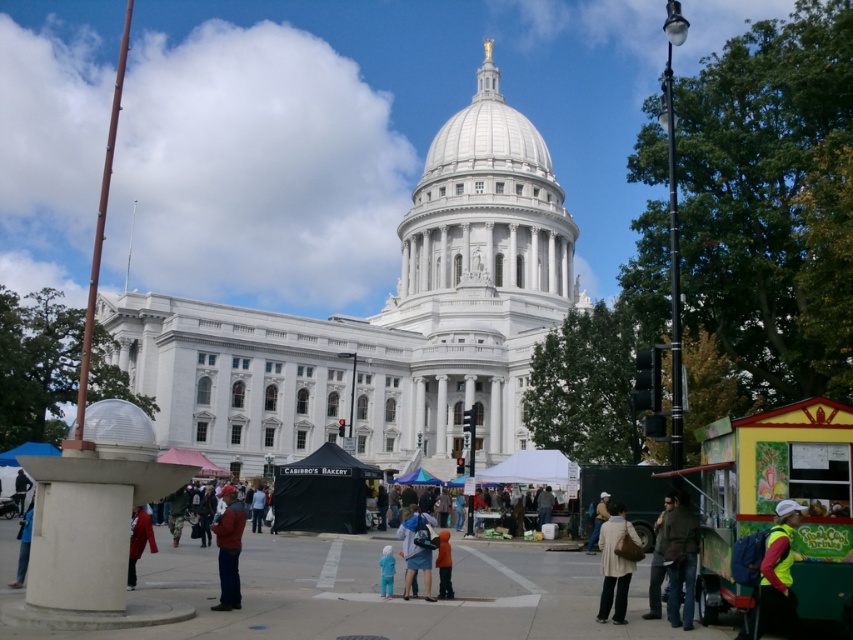
You are standing at the grand white building with a dome and want to take a photo of the point at coordinates (x=653, y=593). If your camera has a maximum focus range of 120 feet, will you be able to capture the point clearly?

The distance of point (x=653, y=593) from the camera is 128.06 feet, which exceeds the camera maximum focus range of 120 feet. Therefore, you won not be able to capture the point clearly.

Consider the image. You are a photographer trying to capture a photo of the white marble dome at center and the multicolored fabric crowd at center. Based on their sizes in the image, which object should you focus on first to ensure it stands out more in the composition?

The white marble dome at center is much taller than the multicolored fabric crowd at center, so focusing on the white marble dome at center first will ensure it stands out more in the composition.